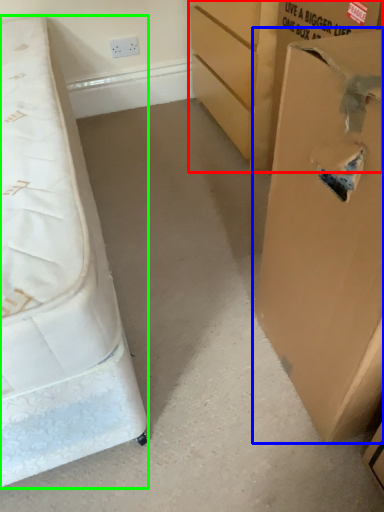
Question: Which object is the closest to the cardboard box (highlighted by a red box)? Choose among these: cardboard box (highlighted by a blue box) or bed (highlighted by a green box).

Choices:
 (A) cardboard box
 (B) bed

Answer: (A)